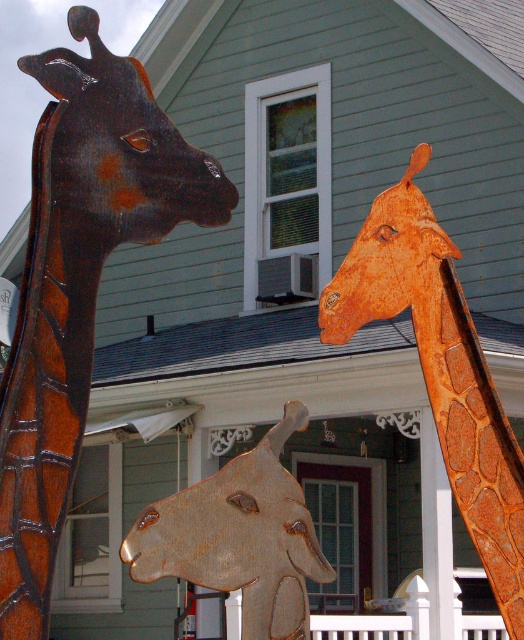
You are standing in front of a decorative installation of three giraffe heads made of rusty metal. You need to place a small decorative plaque between the two giraffes labeled rusty metal giraffe at upper left and rusty metal giraffe at upper right. If the plaque is 2 meters wide, will there be enough space between them to fit it?

The distance between the rusty metal giraffe at upper left and the rusty metal giraffe at upper right is 5.47 meters. Since the plaque is only 2 meters wide, there is sufficient space to place it between them.

You are a delivery person trying to place a small package between the rusty metal giraffe at upper right and the rusty wood giraffe head at center. The package is 5 feet long. Can you fit it between them?

The distance between the rusty metal giraffe at upper right and the rusty wood giraffe head at center is 4.68 feet, which is shorter than the package length of 5 feet. Therefore, the package cannot fit between them.

You are standing in front of a decorative installation of three giraffe heads made of rusty metal. The giraffe heads are part of an art piece in front of a two story house. There is a specific point marked at coordinate (79, 284). Which object does this coordinate correspond to?

The coordinate point (79, 284) corresponds to the rusty metal giraffe at upper left.